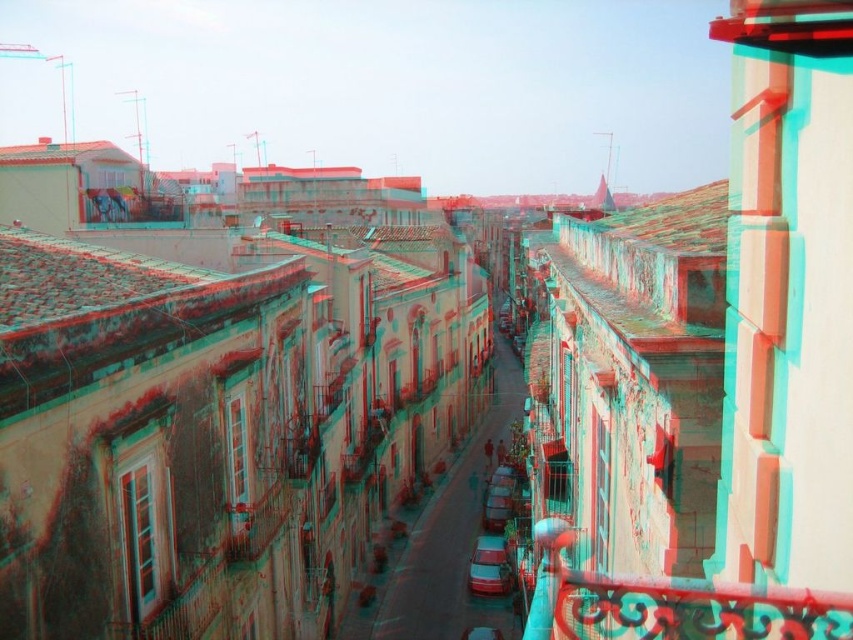
You are standing on a balcony in the European city street scene and want to lean on the polished metal railing at center right. Based on its position, is the railing closer to you or further away from you?

The polished metal railing at center right is located at point (692, 609), which means it is closer to the viewer since the coordinates suggest it is positioned near the front of the scene.

You are a delivery person trying to navigate a narrow street. You see a polished metal railing at center right and a metallic silver car at center. Which object takes up more space in your view?

The polished metal railing at center right is larger in size than the metallic silver car at center, so it takes up more space in your view.

You are a delivery driver trying to navigate through the narrow street. There is a metallic silver car at center and a shiny red car at center. How far apart are these two cars from each other?

The metallic silver car at center is 12.28 meters from the shiny red car at center.